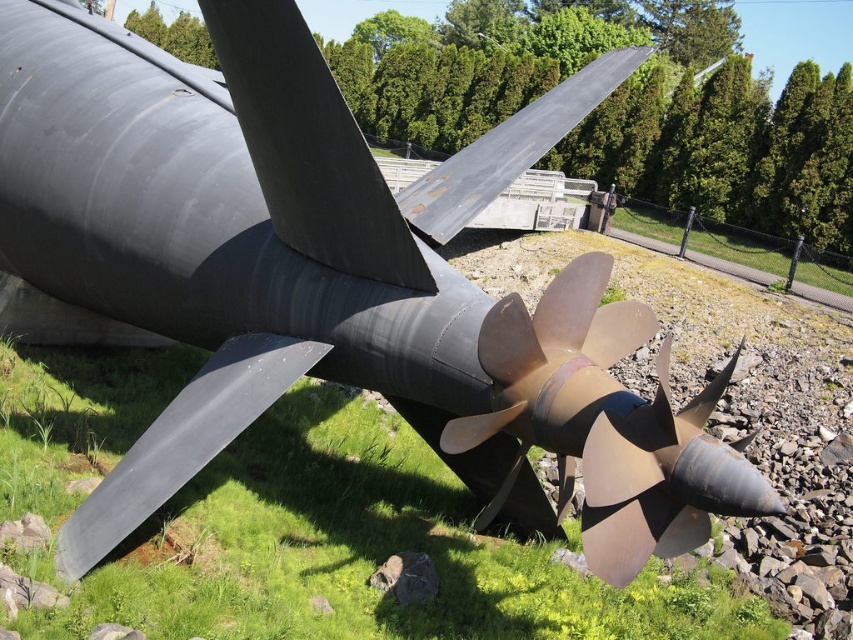
Question: Which point is closer to the camera?

Choices:
 (A) matte gold propeller at center
 (B) rusty metallic blade at upper center

Answer: (A)

Question: Does green grass at center appear on the right side of rusty metallic blade at upper center?

Choices:
 (A) no
 (B) yes

Answer: (A)

Question: Is matte gold propeller at center bigger than matte black propeller blade at center?

Choices:
 (A) yes
 (B) no

Answer: (A)

Question: Which point is farther to the camera?

Choices:
 (A) green grass at center
 (B) rusty metallic blade at upper center

Answer: (B)

Question: Can you confirm if green grass at center is bigger than matte black propeller blade at center?

Choices:
 (A) no
 (B) yes

Answer: (B)

Question: Estimate the real-world distances between objects in this image. Which object is closer to the matte black propeller blade at center?

Choices:
 (A) green grass at center
 (B) rusty metallic blade at upper center

Answer: (B)